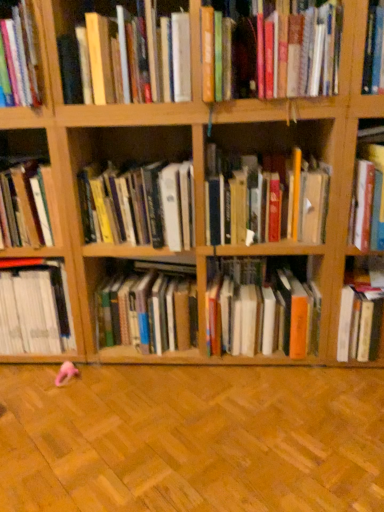
Question: Is hardcover book at center, which is the eighth book in left-to-right order, inside orange matte book at center, arranged as the 9th book when viewed from the left?

Choices:
 (A) yes
 (B) no

Answer: (B)

Question: From the image's perspective, is orange matte book at center, arranged as the third book when viewed from the right, over hardcover book at center, which is the eighth book in left-to-right order?

Choices:
 (A) no
 (B) yes

Answer: (A)

Question: Considering the relative positions of orange matte book at center, arranged as the third book when viewed from the right, and hardcover book at center, which is the eighth book in left-to-right order, in the image provided, is orange matte book at center, arranged as the third book when viewed from the right, to the left of hardcover book at center, which is the eighth book in left-to-right order, from the viewer's perspective?

Choices:
 (A) no
 (B) yes

Answer: (A)

Question: Is orange matte book at center, arranged as the 9th book when viewed from the left, facing towards hardcover book at center, which appears as the 4th book when viewed from the right?

Choices:
 (A) yes
 (B) no

Answer: (B)

Question: From the image's perspective, does orange matte book at center, arranged as the third book when viewed from the right, appear lower than hardcover book at center, which appears as the 4th book when viewed from the right?

Choices:
 (A) no
 (B) yes

Answer: (B)

Question: Is orange matte book at center, arranged as the third book when viewed from the right, directly adjacent to hardcover book at center, which is the eighth book in left-to-right order?

Choices:
 (A) yes
 (B) no

Answer: (B)

Question: Does white matte book at left, the 2th book when ordered from left to right, appear on the left side of hardcover book at right, placed as the 1th book when sorted from right to left?

Choices:
 (A) no
 (B) yes

Answer: (B)

Question: Is white matte book at left, the tenth book positioned from the right, oriented away from hardcover book at right, which is the eleventh book from left to right?

Choices:
 (A) yes
 (B) no

Answer: (B)

Question: Considering the relative sizes of white matte book at left, the tenth book positioned from the right, and hardcover book at right, placed as the 1th book when sorted from right to left, in the image provided, is white matte book at left, the tenth book positioned from the right, thinner than hardcover book at right, placed as the 1th book when sorted from right to left,?

Choices:
 (A) yes
 (B) no

Answer: (A)

Question: Considering the relative sizes of white matte book at left, the 2th book when ordered from left to right, and hardcover book at right, placed as the 1th book when sorted from right to left, in the image provided, is white matte book at left, the 2th book when ordered from left to right, bigger than hardcover book at right, placed as the 1th book when sorted from right to left,?

Choices:
 (A) yes
 (B) no

Answer: (A)

Question: Considering the relative sizes of white matte book at left, the tenth book positioned from the right, and hardcover book at right, which is the eleventh book from left to right, in the image provided, is white matte book at left, the tenth book positioned from the right, smaller than hardcover book at right, which is the eleventh book from left to right,?

Choices:
 (A) no
 (B) yes

Answer: (A)

Question: Is white matte book at left, the tenth book positioned from the right, surrounding hardcover book at right, which is the eleventh book from left to right?

Choices:
 (A) no
 (B) yes

Answer: (A)

Question: Is the position of hardcover book at upper right, which is counted as the 2th book, starting from the right, less distant than that of orange matte book at center, arranged as the 9th book when viewed from the left?

Choices:
 (A) yes
 (B) no

Answer: (A)